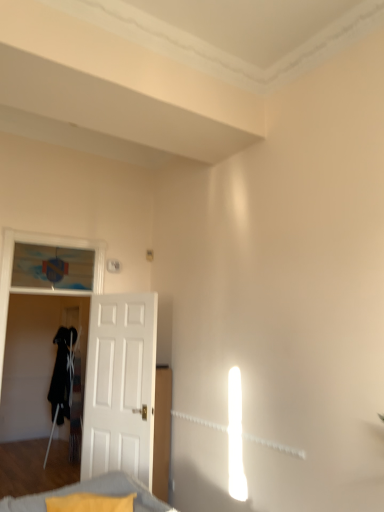
Question: From a real-world perspective, is white wooden door at left positioned under soft gray fabric cushion at lower left based on gravity?

Choices:
 (A) yes
 (B) no

Answer: (B)

Question: Can you confirm if white wooden door at left is bigger than soft gray fabric cushion at lower left?

Choices:
 (A) no
 (B) yes

Answer: (B)

Question: Considering the relative sizes of white wooden door at left and soft gray fabric cushion at lower left in the image provided, is white wooden door at left smaller than soft gray fabric cushion at lower left?

Choices:
 (A) yes
 (B) no

Answer: (B)

Question: Does white wooden door at left have a greater width compared to soft gray fabric cushion at lower left?

Choices:
 (A) no
 (B) yes

Answer: (A)

Question: Is the position of white wooden door at left more distant than that of soft gray fabric cushion at lower left?

Choices:
 (A) yes
 (B) no

Answer: (A)

Question: Considering the relative sizes of white wooden door at left and soft gray fabric cushion at lower left in the image provided, is white wooden door at left taller than soft gray fabric cushion at lower left?

Choices:
 (A) yes
 (B) no

Answer: (A)

Question: Can you confirm if soft gray fabric cushion at lower left is positioned to the left of white wooden door at left?

Choices:
 (A) yes
 (B) no

Answer: (B)

Question: Can you confirm if soft gray fabric cushion at lower left is shorter than white wooden door at left?

Choices:
 (A) no
 (B) yes

Answer: (B)

Question: Is there a large distance between soft gray fabric cushion at lower left and white wooden door at left?

Choices:
 (A) yes
 (B) no

Answer: (A)

Question: Would you say soft gray fabric cushion at lower left is outside white wooden door at left?

Choices:
 (A) no
 (B) yes

Answer: (B)

Question: From the image's perspective, does soft gray fabric cushion at lower left appear higher than white wooden door at left?

Choices:
 (A) no
 (B) yes

Answer: (A)

Question: Considering the relative sizes of soft gray fabric cushion at lower left and white wooden door at left in the image provided, is soft gray fabric cushion at lower left bigger than white wooden door at left?

Choices:
 (A) no
 (B) yes

Answer: (A)

Question: Is soft gray fabric cushion at lower left to the left or to the right of white wooden door at left in the image?

Choices:
 (A) left
 (B) right

Answer: (B)